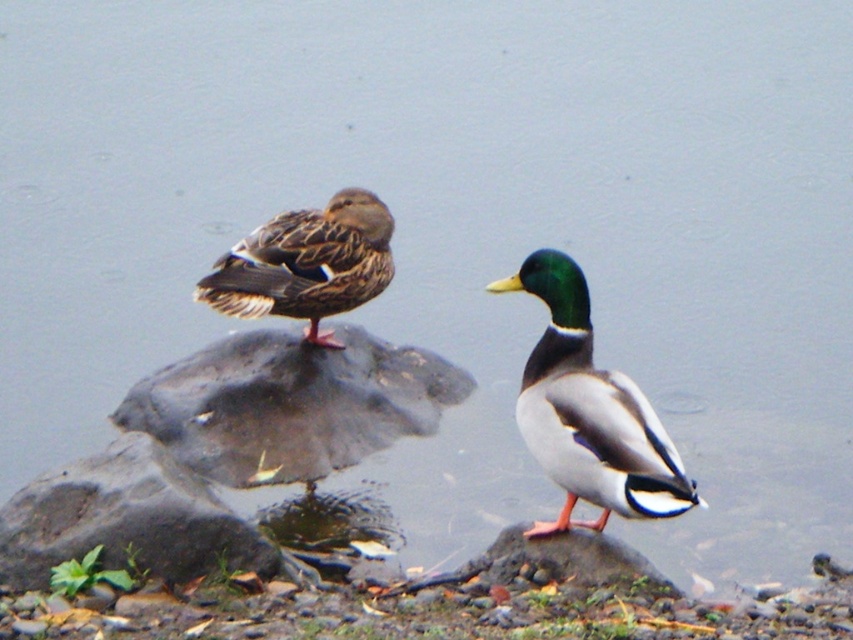
Question: Does green glossy duck at center appear on the left side of brown speckled feathers at center?

Choices:
 (A) no
 (B) yes

Answer: (A)

Question: Which of the following is the closest to the observer?

Choices:
 (A) (308, 275)
 (B) (581, 529)
 (C) (553, 397)
 (D) (30, 508)

Answer: (C)

Question: Which point appears closest to the camera in this image?

Choices:
 (A) (554, 362)
 (B) (216, 538)

Answer: (A)

Question: Considering the real-world distances, which object is closest to the smooth gray rock at center?

Choices:
 (A) brown speckled feathers at center
 (B) gray rough rock at lower left
 (C) green glossy duck at center

Answer: (C)

Question: Can you confirm if gray rough rock at lower left is positioned to the left of smooth gray rock at center?

Choices:
 (A) no
 (B) yes

Answer: (B)

Question: Is gray rough rock at lower left positioned behind brown speckled feathers at center?

Choices:
 (A) yes
 (B) no

Answer: (B)